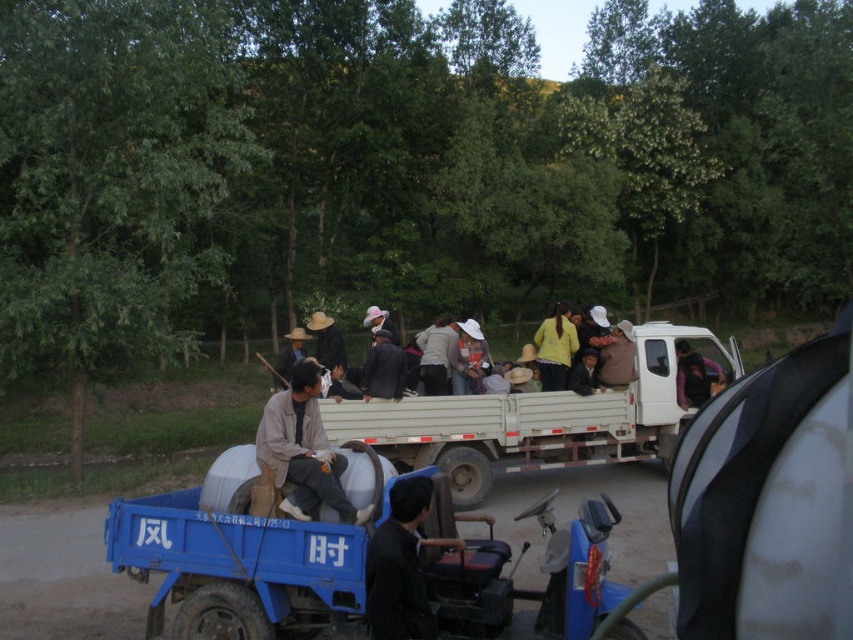
Does white matte truck at center appear on the left side of light brown straw hat at center?

No, white matte truck at center is not to the left of light brown straw hat at center.

Between point (397, 417) and point (577, 346), which one is positioned behind?

Positioned behind is point (577, 346).

I want to click on white matte truck at center, so [537, 419].

Does point (314, 468) come behind point (341, 362)?

No, (314, 468) is closer to viewer.

Which of these two, light brown fabric jacket at center or light brown straw hat at center, stands shorter?

light brown fabric jacket at center

Locate an element on the screen. Image resolution: width=853 pixels, height=640 pixels. light brown fabric jacket at center is located at coordinates (303, 451).

Who is shorter, white matte truck at center or light brown fabric jacket at center?

light brown fabric jacket at center

Where is `white matte truck at center`? white matte truck at center is located at coordinates (537, 419).

This screenshot has height=640, width=853. What are the coordinates of `white matte truck at center` in the screenshot? It's located at (537, 419).